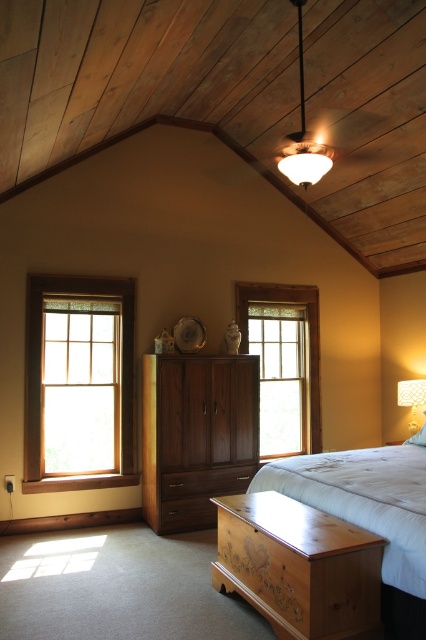
You are trying to rearrange the furniture in the bedroom. If you want to move the dark wood drawer at center closer to the window on the right, will the white matte bed at center block your path? Please explain why based on their sizes.

The white matte bed at center is bigger than the dark wood drawer at center. Since the bed is larger, it might occupy more space in the center area, potentially blocking the path to move the dark wood drawer at center closer to the window on the right. However, the exact path depends on the room layout and available space around the bed.

You are standing in the bedroom and want to lie down on the white matte bed at center. Which direction should you move to reach it from your current position near the clear glass window at center?

The white matte bed at center is located below the clear glass window at center, so you should move downward to reach it.